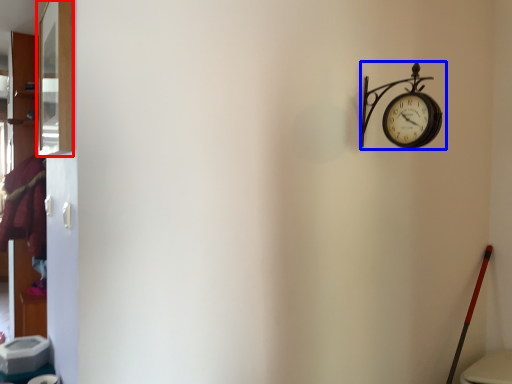
Question: Which of the following is the farthest to the observer, window (highlighted by a red box) or wall clock (highlighted by a blue box)?

Choices:
 (A) window
 (B) wall clock

Answer: (B)